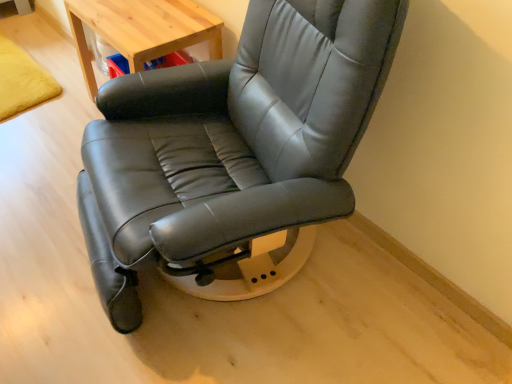
Question: Does black leather chair at center have a smaller size compared to light wood table at upper left?

Choices:
 (A) yes
 (B) no

Answer: (B)

Question: Is black leather chair at center next to light wood table at upper left and touching it?

Choices:
 (A) yes
 (B) no

Answer: (B)

Question: Is black leather chair at center to the right of light wood table at upper left from the viewer's perspective?

Choices:
 (A) yes
 (B) no

Answer: (A)

Question: Does black leather chair at center have a greater width compared to light wood table at upper left?

Choices:
 (A) yes
 (B) no

Answer: (A)

Question: Is black leather chair at center further to the viewer compared to light wood table at upper left?

Choices:
 (A) yes
 (B) no

Answer: (B)

Question: Could you tell me if black leather chair at center is facing light wood table at upper left?

Choices:
 (A) yes
 (B) no

Answer: (B)

Question: From the image's perspective, is light wood table at upper left on top of black leather chair at center?

Choices:
 (A) no
 (B) yes

Answer: (B)

Question: Are light wood table at upper left and black leather chair at center beside each other?

Choices:
 (A) yes
 (B) no

Answer: (B)

Question: Is black leather chair at center at the back of light wood table at upper left?

Choices:
 (A) yes
 (B) no

Answer: (B)

Question: Would you say light wood table at upper left is a long distance from black leather chair at center?

Choices:
 (A) no
 (B) yes

Answer: (A)

Question: From a real-world perspective, is light wood table at upper left physically above black leather chair at center?

Choices:
 (A) no
 (B) yes

Answer: (A)

Question: Considering the relative sizes of light wood table at upper left and black leather chair at center in the image provided, is light wood table at upper left bigger than black leather chair at center?

Choices:
 (A) no
 (B) yes

Answer: (A)

Question: Considering the positions of black leather chair at center and light wood table at upper left in the image, is black leather chair at center wider or thinner than light wood table at upper left?

Choices:
 (A) wide
 (B) thin

Answer: (A)